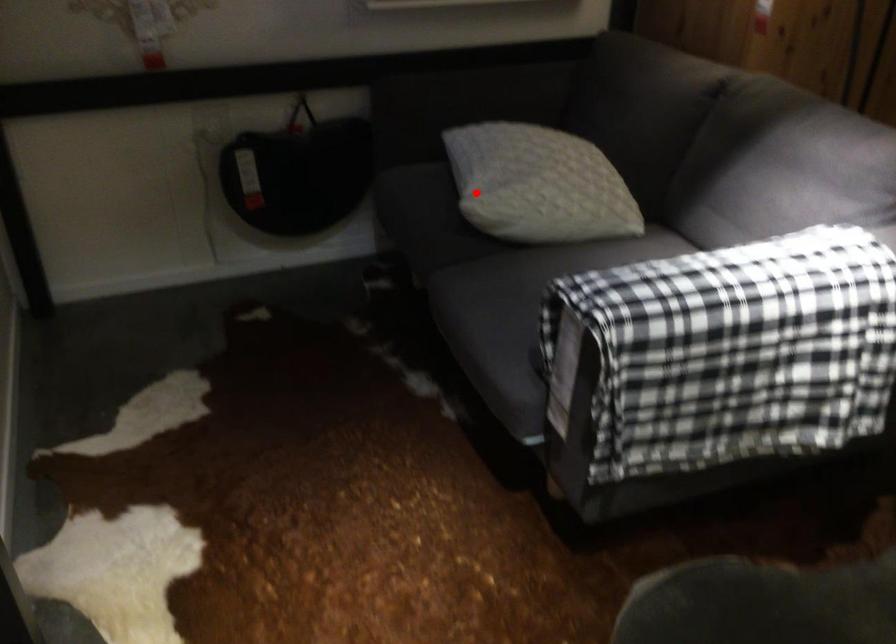
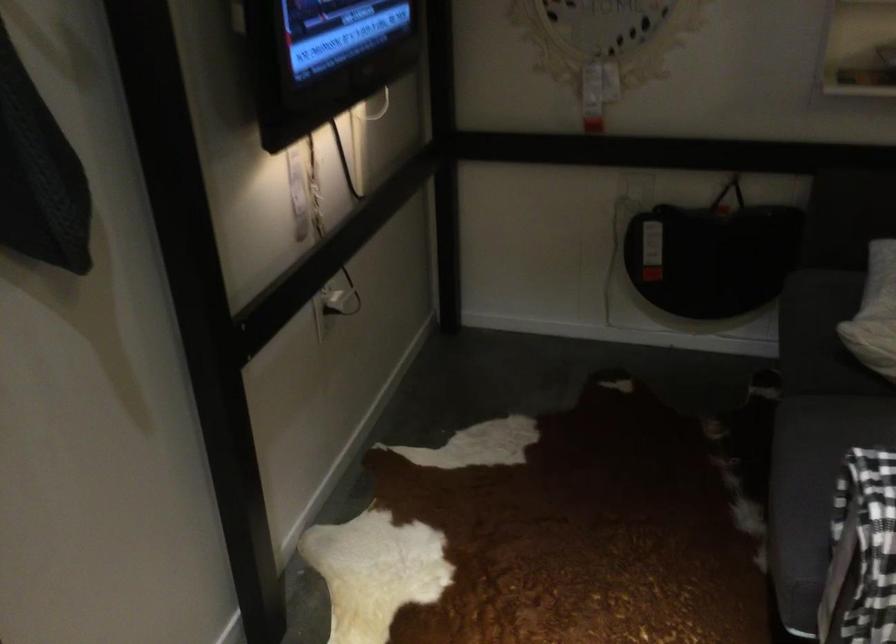
Find the pixel in the second image that matches the highlighted location in the first image.

(874, 313)